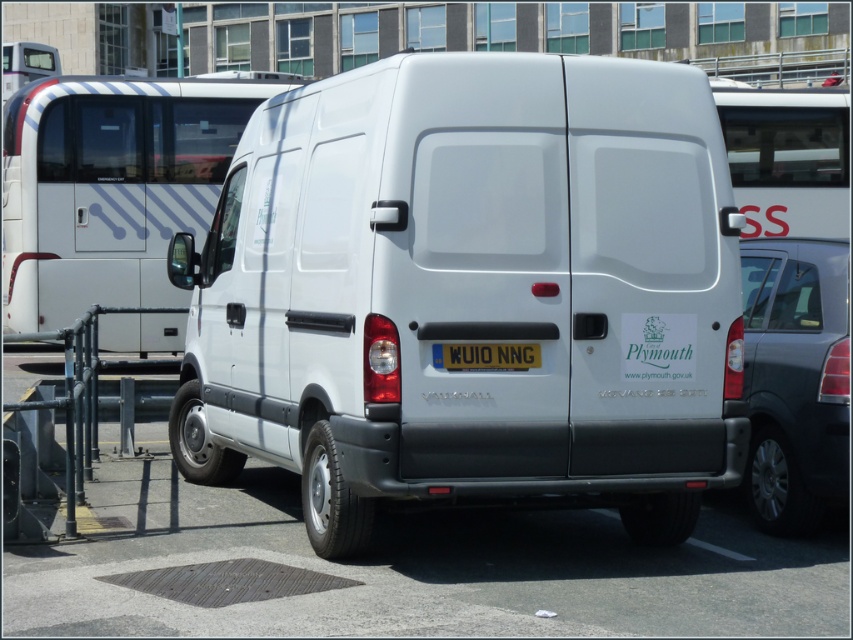
Looking at this image, you are a delivery person who needs to back up your white matte van at center into a loading bay that is 6 meters away. Can you safely back into the loading bay without hitting any obstacles?

The white matte van at center and camera are 5.94 meters apart. Since the distance between them is less than 6 meters, the van can safely back into the loading bay without hitting any obstacles.

You are a delivery driver who needs to park your white matte van at center between two vehicles. The vehicle on the right is a satin black car at right. Considering their heights, will your van fit between them without hitting the roof?

The white matte van at center is much taller than the satin black car at right, so it will hit the roof if parked between them.

You are a delivery driver who needs to park your vehicle between two other vehicles in the parking lot. You see a white matte van at center and a white glossy minibus at center. Which vehicle should you park behind to ensure you are in the correct parking spot?

You should park behind the white glossy minibus at center because the white matte van at center is located above it, meaning the minibus is positioned lower and likely closer to the parking spot entrance.